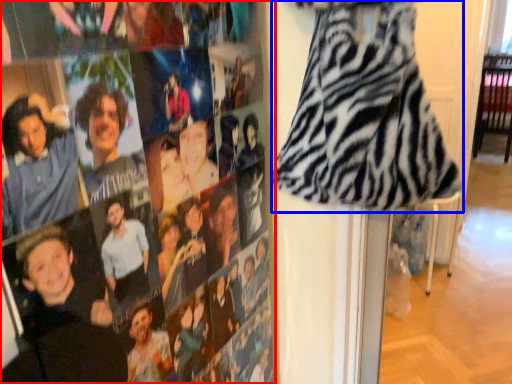
Question: Which object is further to the camera taking this photo, person (highlighted by a red box) or fancy dress (highlighted by a blue box)?

Choices:
 (A) person
 (B) fancy dress

Answer: (B)